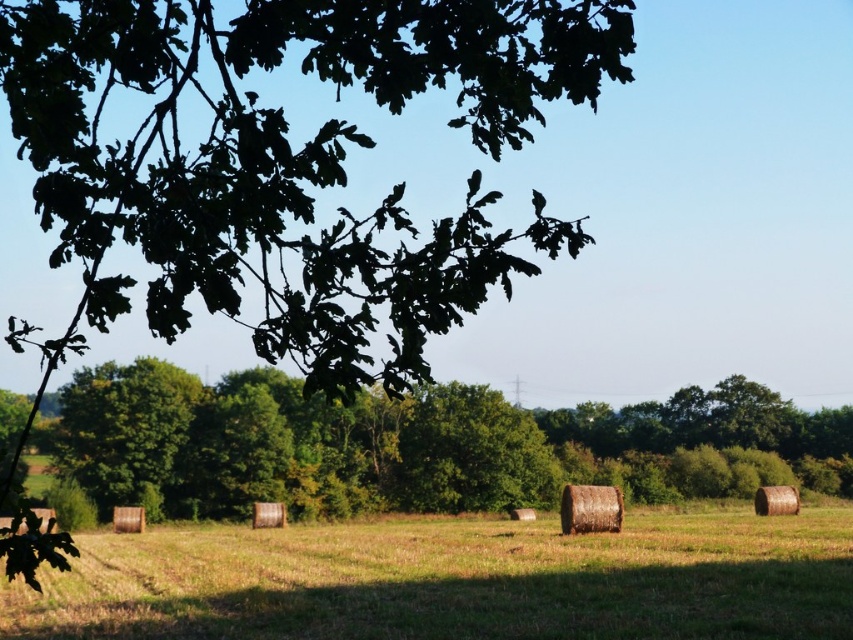
You are a drone operator trying to capture a photo of the green grass at center and the green leafy tree at center. From your current position, which object would appear closer to the camera?

The green grass at center is located below green leafy tree at center, so the green grass at center would appear closer to the camera since it is positioned lower in the frame.